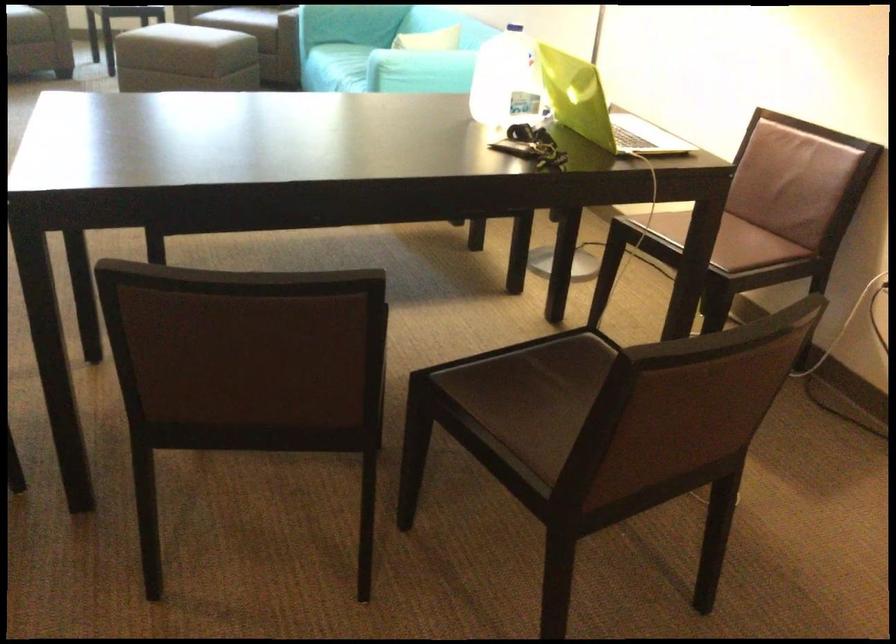
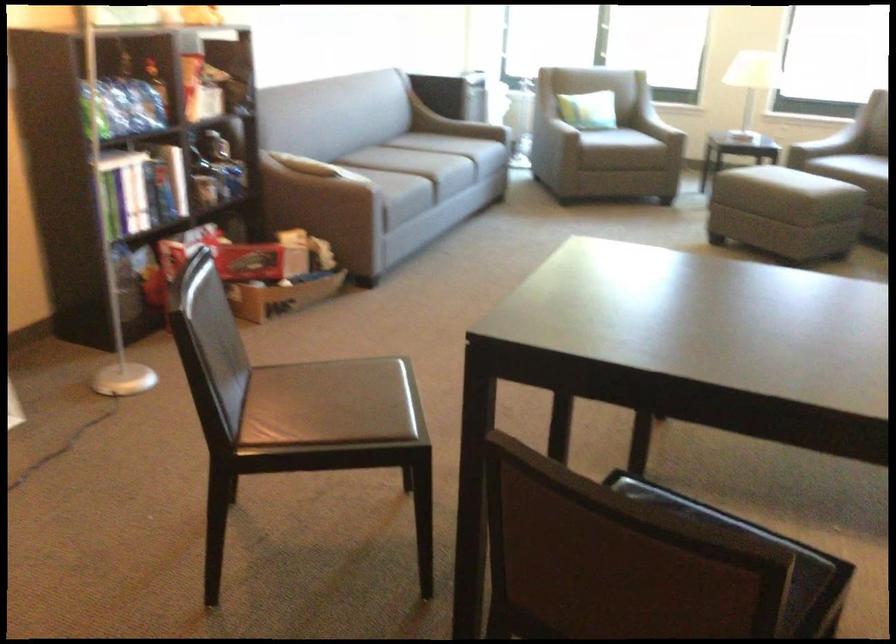
First-person continuous shooting, in which direction is the camera rotating?

The camera rotated toward right-down.